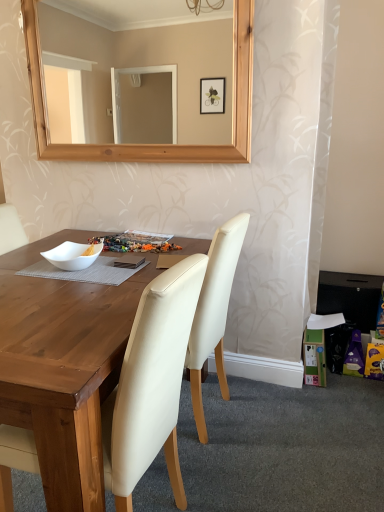
Identify the location of vacant space situated on the left part of white matte bowl at center. This screenshot has height=512, width=384. (22, 276).